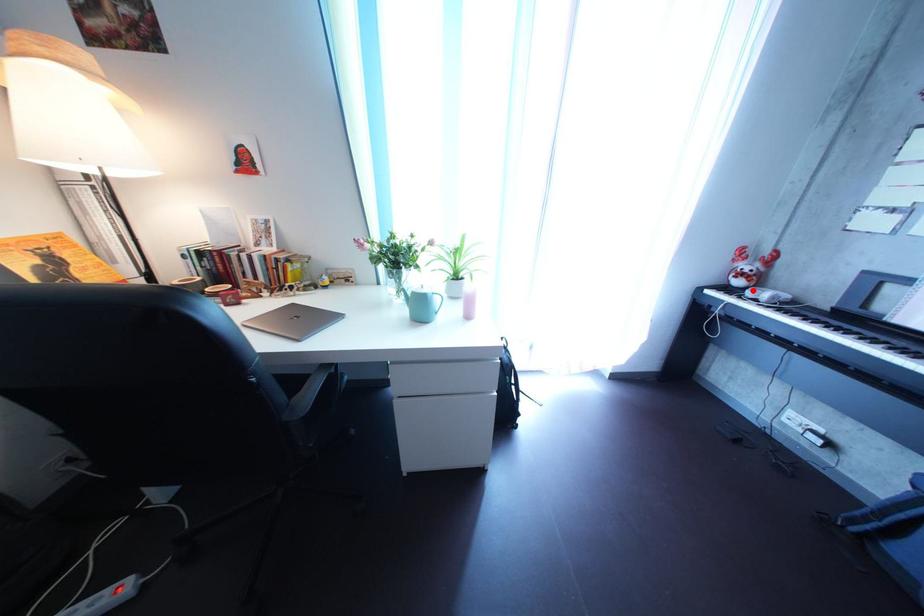
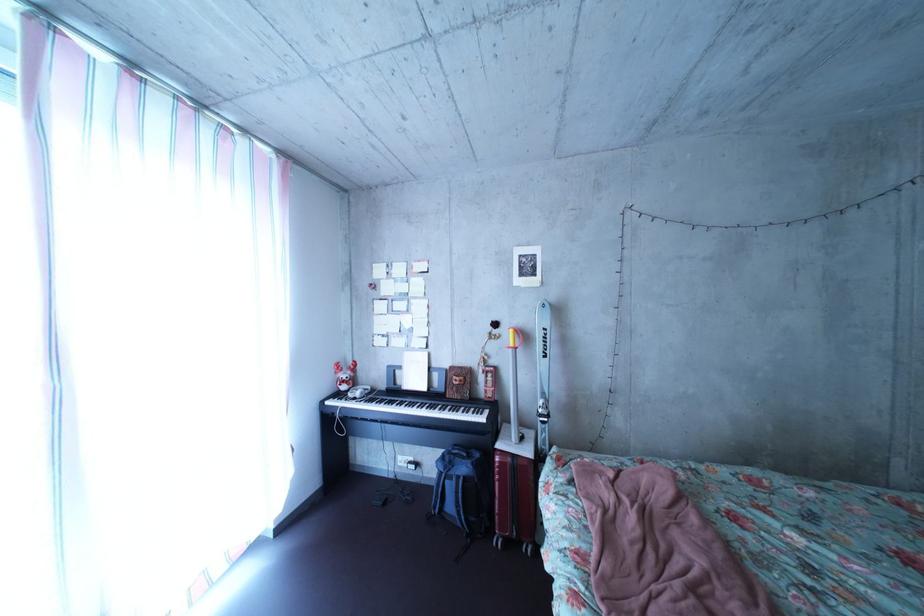
Question: I am providing you with two images of the same scene from different viewpoints. In image1, a red point is highlighted. Considering the same 3D point in image2, which of the following is correct?

Choices:
 (A) It is closer
 (B) It is farther

Answer: (B)